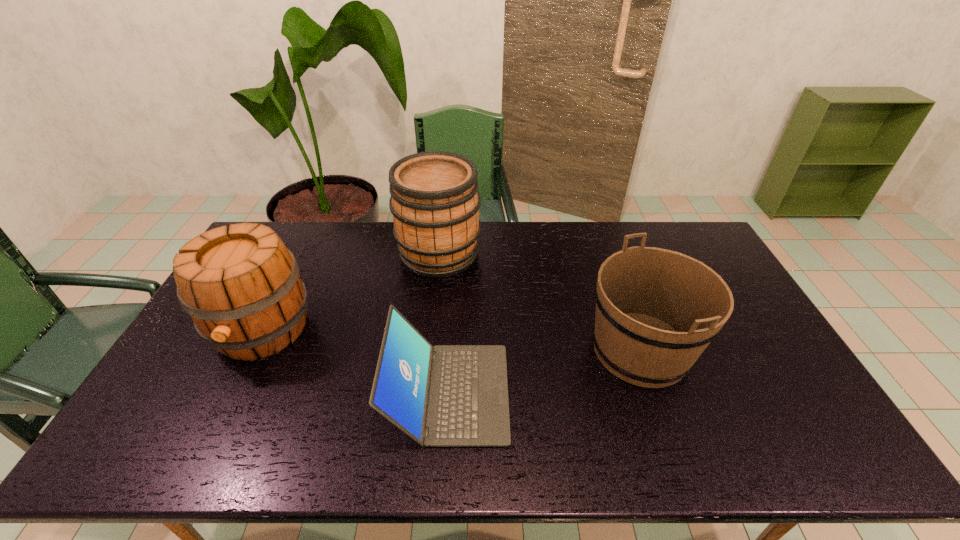
Identify the location of object present at the far edge. The width and height of the screenshot is (960, 540). (435, 202).

I want to click on object that is at the near edge, so click(x=448, y=395).

Find the location of `object that is at the left edge`. object that is at the left edge is located at coordinates (241, 286).

Image resolution: width=960 pixels, height=540 pixels. In the image, there is a desktop. In order to click on vacant area at the far edge in this screenshot , I will do `click(542, 252)`.

This screenshot has height=540, width=960. Identify the location of blank area at the near edge. (539, 462).

The image size is (960, 540). What are the coordinates of `free space at the right edge of the desktop` in the screenshot? It's located at (761, 339).

Locate an element on the screen. The width and height of the screenshot is (960, 540). vacant space at the far left corner of the desktop is located at coordinates (291, 250).

You are a GUI agent. You are given a task and a screenshot of the screen. Output one action in this format:
    pyautogui.click(x=<x>, y=<y>)
    Task: Click on the free point at the near left corner
    
    Given the screenshot: What is the action you would take?
    163,461

I want to click on free space between the farthest object and the bucket, so click(540, 301).

The height and width of the screenshot is (540, 960). Identify the location of vacant space that's between the left cider and the rightmost object. (451, 340).